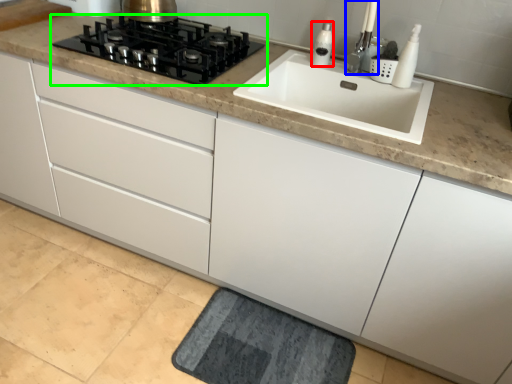
Question: Based on their relative distances, which object is nearer to soap dispenser (highlighted by a red box)? Choose from faucet (highlighted by a blue box) and gas stove (highlighted by a green box).

Choices:
 (A) faucet
 (B) gas stove

Answer: (A)